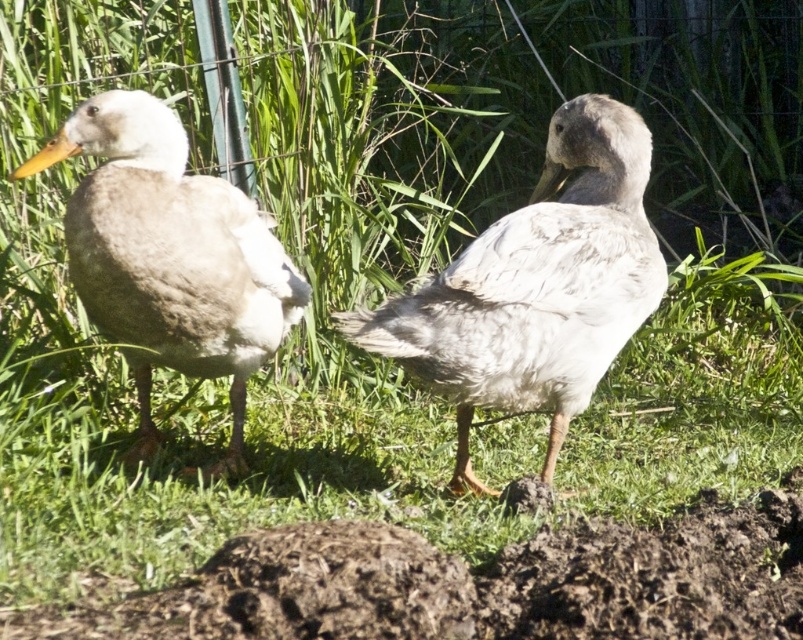
You are standing in a natural setting with two ducks. There is a point marked at coordinates point (292, 595). You want to place a small bird feeder exactly at that point. Considering the ducks are at their current positions, will the feeder be visible to both ducks?

The point (292, 595) is 6.70 feet away from the viewer, so the feeder placed there would be visible to both ducks as long as there are no obstructions between them and the feeder.

You are a photographer trying to capture both the white fluffy duck at center and the white matte duck at left. Which duck should you focus on first to ensure both are in sharp focus?

You should focus on the white fluffy duck at center first because it is closer to you than the white matte duck at left. By focusing on the closer duck, the farther one will also be in focus due to the depth of field.